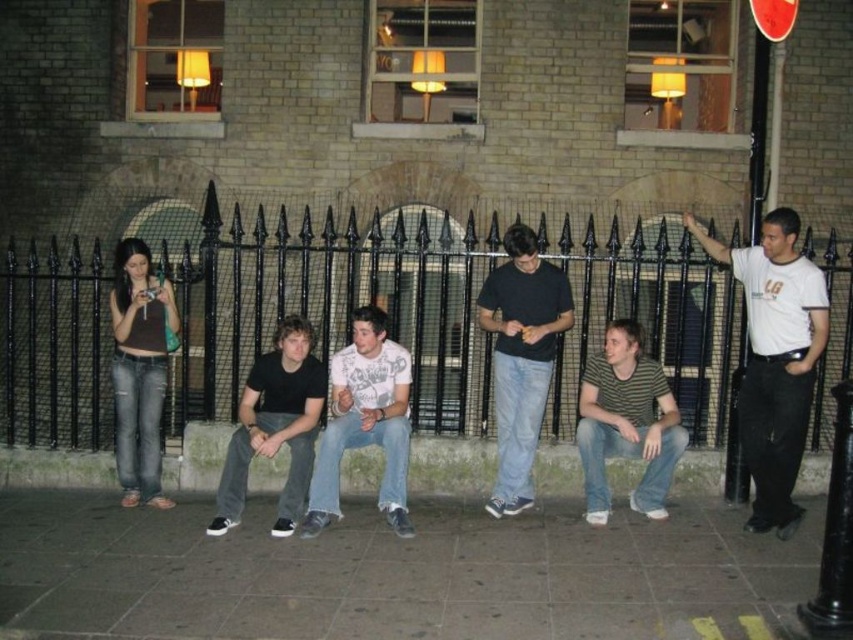
Question: Which point is closer to the camera?

Choices:
 (A) white printed t-shirt at center
 (B) black matte shirt at center
 (C) striped cotton shirt at center

Answer: (A)

Question: Which is nearer to the white t-shirt at right?

Choices:
 (A) black metal fence at center
 (B) striped cotton shirt at center
 (C) black matte shirt at center
 (D) gray concrete pavement at lower center

Answer: (B)

Question: Which object is closer to the camera taking this photo?

Choices:
 (A) dark gray jeans at center
 (B) white printed t-shirt at center

Answer: (B)

Question: Is smooth concrete curb at lower center thinner than dark gray jeans at center?

Choices:
 (A) yes
 (B) no

Answer: (A)

Question: Is black metal fence at center bigger than smooth concrete curb at lower center?

Choices:
 (A) yes
 (B) no

Answer: (A)

Question: Can you confirm if black matte shirt at center is wider than striped cotton shirt at center?

Choices:
 (A) yes
 (B) no

Answer: (B)